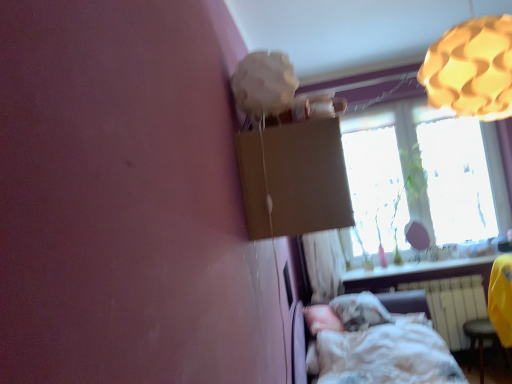
Question: Does smooth white window sill at lower right have a smaller size compared to white cotton bed at lower right?

Choices:
 (A) no
 (B) yes

Answer: (B)

Question: Does smooth white window sill at lower right have a larger size compared to white cotton bed at lower right?

Choices:
 (A) yes
 (B) no

Answer: (B)

Question: Is smooth white window sill at lower right positioned in front of white cotton bed at lower right?

Choices:
 (A) yes
 (B) no

Answer: (B)

Question: Is smooth white window sill at lower right shorter than white cotton bed at lower right?

Choices:
 (A) yes
 (B) no

Answer: (A)

Question: From a real-world perspective, is smooth white window sill at lower right located higher than white cotton bed at lower right?

Choices:
 (A) yes
 (B) no

Answer: (A)

Question: Is smooth white window sill at lower right taller than white cotton bed at lower right?

Choices:
 (A) no
 (B) yes

Answer: (A)

Question: From the image's perspective, is white cotton bed at lower right under white paper lampshade at upper center, placed as the 1th lamp when sorted from left to right?

Choices:
 (A) no
 (B) yes

Answer: (B)

Question: Is white cotton bed at lower right smaller than white paper lampshade at upper center, which ranks as the 2th lamp in right-to-left order?

Choices:
 (A) no
 (B) yes

Answer: (A)

Question: Does white cotton bed at lower right lie behind white paper lampshade at upper center, placed as the 1th lamp when sorted from left to right?

Choices:
 (A) yes
 (B) no

Answer: (A)

Question: Could you tell me if white cotton bed at lower right is turned towards white paper lampshade at upper center, which ranks as the 2th lamp in right-to-left order?

Choices:
 (A) yes
 (B) no

Answer: (B)

Question: Can you confirm if white cotton bed at lower right is bigger than white paper lampshade at upper center, placed as the 1th lamp when sorted from left to right?

Choices:
 (A) no
 (B) yes

Answer: (B)

Question: Is white cotton bed at lower right closer to the viewer compared to white paper lampshade at upper center, which ranks as the 2th lamp in right-to-left order?

Choices:
 (A) yes
 (B) no

Answer: (B)

Question: Is white matte radiator at lower right completely or partially inside translucent glass window at upper right?

Choices:
 (A) yes
 (B) no

Answer: (B)